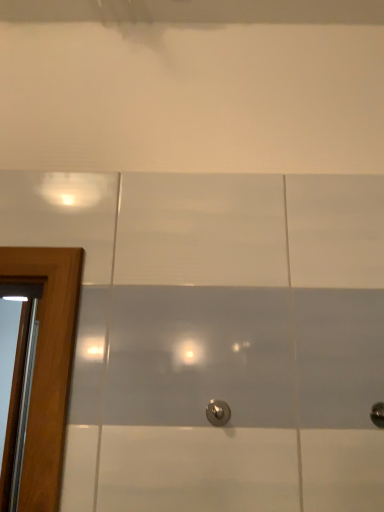
Locate an element on the screen. polished metallic door handle at center is located at coordinates (218, 412).

The image size is (384, 512). Describe the element at coordinates (218, 412) in the screenshot. I see `polished metallic door handle at center` at that location.

In order to face polished metallic door handle at center, should I rotate leftwards or rightwards?

To align with it, rotate right about 3.558°.

You are a GUI agent. You are given a task and a screenshot of the screen. Output one action in this format:
    pyautogui.click(x=<x>, y=<y>)
    Task: Click on the polished metallic door handle at center
    Image resolution: width=384 pixels, height=512 pixels.
    Given the screenshot: What is the action you would take?
    pyautogui.click(x=218, y=412)